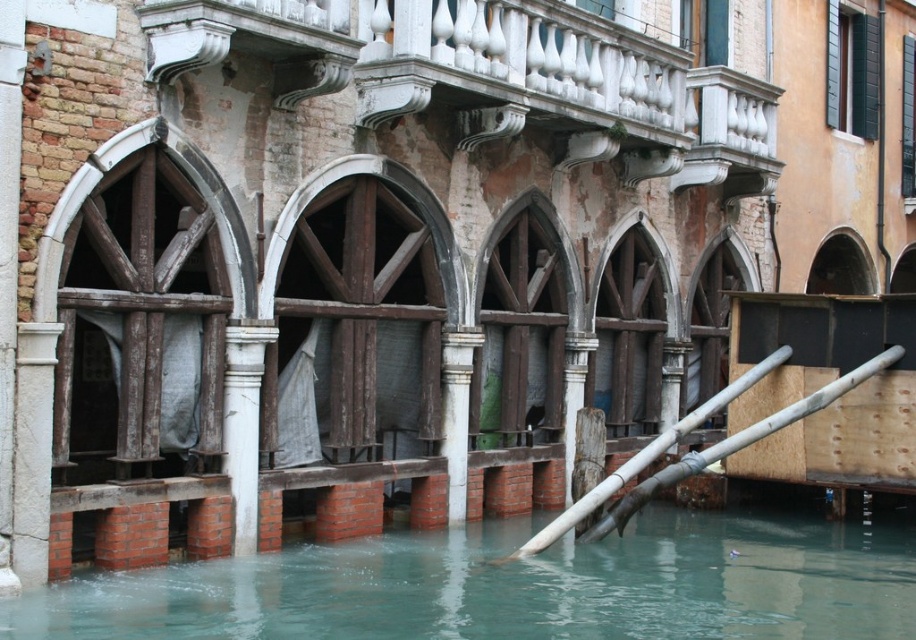
Question: Does smooth bamboo pole at lower right have a lesser width compared to white stone column at center?

Choices:
 (A) yes
 (B) no

Answer: (B)

Question: Which point is farther to the camera?

Choices:
 (A) (503, 252)
 (B) (675, 616)

Answer: (A)

Question: Estimate the real-world distances between objects in this image. Which object is farther from the white stone column at center?

Choices:
 (A) wooden/wooden-textured archway at center
 (B) white marble balcony at upper center
 (C) green wood archway at center
 (D) clear water at lower center

Answer: (A)

Question: Does wooden/wooden-textured archway at center appear over white stone column at center?

Choices:
 (A) no
 (B) yes

Answer: (B)

Question: Does wooden/wooden-textured archway at center have a lesser width compared to smooth bamboo pole at lower right?

Choices:
 (A) no
 (B) yes

Answer: (B)

Question: Which is nearer to the clear water at lower center?

Choices:
 (A) white stone column at center
 (B) white marble balcony at upper center
 (C) wooden/wooden-textured archway at center
 (D) smooth bamboo pole at lower right

Answer: (D)